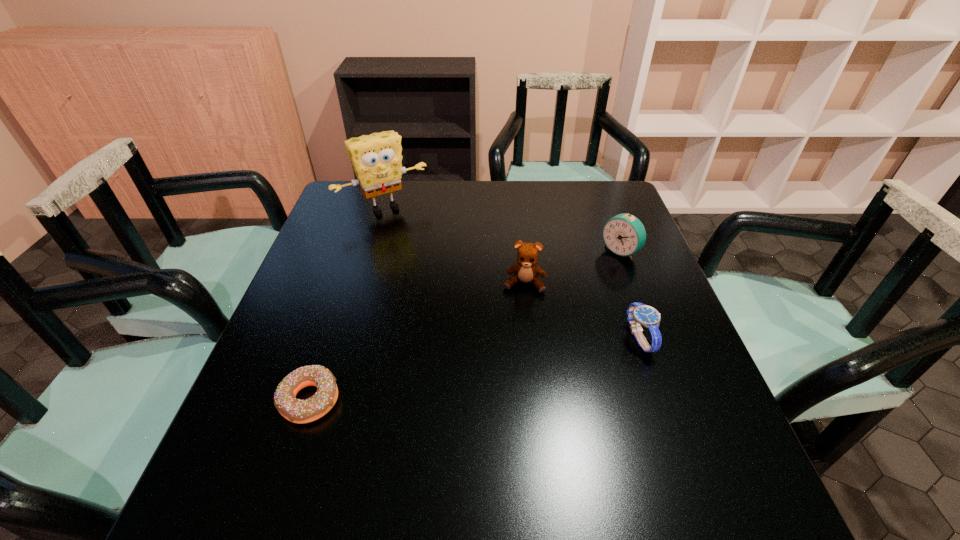
Image resolution: width=960 pixels, height=540 pixels. I want to click on object situated at the far edge, so click(376, 158).

Where is `object located in the near edge section of the desktop`? object located in the near edge section of the desktop is located at coordinates (295, 410).

Find the location of a particular element. doughnut situated at the left edge is located at coordinates (295, 410).

At what (x,y) coordinates should I click in order to perform the action: click on sponge that is at the left edge. Please return your answer as a coordinate pair (x, y). The height and width of the screenshot is (540, 960). Looking at the image, I should click on (376, 158).

Where is `watch located in the right edge section of the desktop`? This screenshot has width=960, height=540. watch located in the right edge section of the desktop is located at coordinates (638, 313).

The width and height of the screenshot is (960, 540). I want to click on alarm clock at the right edge, so click(x=624, y=234).

Locate an element on the screen. object that is at the far left corner is located at coordinates (376, 158).

The image size is (960, 540). I want to click on object that is positioned at the near left corner, so click(295, 410).

In the image, there is a desktop. At what (x,y) coordinates should I click in order to perform the action: click on free space at the far edge. Please return your answer as a coordinate pair (x, y). Looking at the image, I should click on (447, 188).

In the image, there is a desktop. At what (x,y) coordinates should I click in order to perform the action: click on vacant region at the near edge. Please return your answer as a coordinate pair (x, y). This screenshot has height=540, width=960. Looking at the image, I should click on (476, 449).